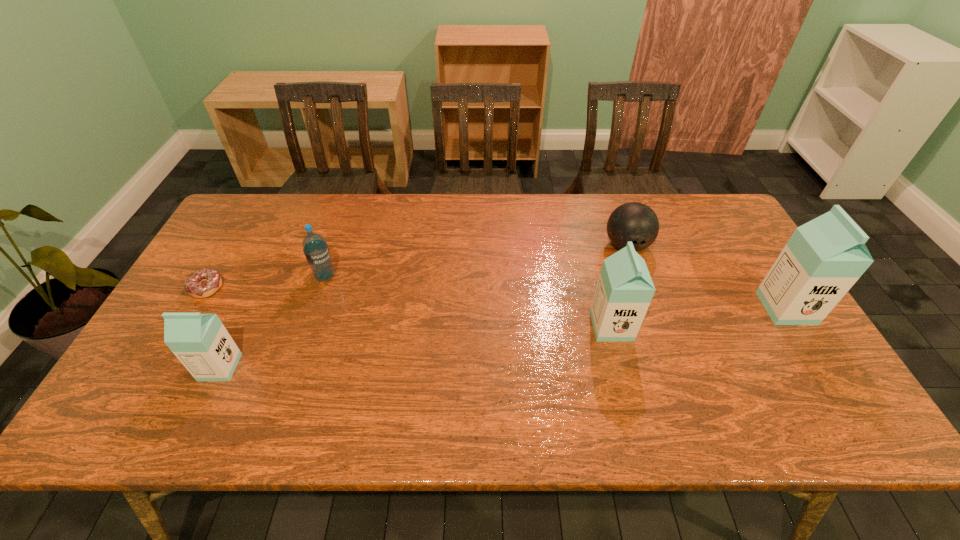
Locate an element on the screen. doughnut that is at the left edge is located at coordinates (203, 283).

I want to click on object positioned at the right edge, so click(x=823, y=259).

The height and width of the screenshot is (540, 960). What are the coordinates of `object that is at the near left corner` in the screenshot? It's located at (200, 341).

The image size is (960, 540). What are the coordinates of `vacant space at the far edge of the desktop` in the screenshot? It's located at (663, 197).

Locate an element on the screen. This screenshot has height=540, width=960. vacant region at the near edge of the desktop is located at coordinates click(x=307, y=374).

At what (x,y) coordinates should I click in order to perform the action: click on vacant space at the left edge. Please return your answer as a coordinate pair (x, y). Looking at the image, I should click on (220, 309).

At what (x,y) coordinates should I click in order to perform the action: click on vacant region at the right edge of the desktop. Please return your answer as a coordinate pair (x, y). Looking at the image, I should click on (703, 255).

In the image, there is a desktop. In order to click on vacant space at the far left corner in this screenshot , I will do `click(250, 208)`.

Identify the location of vacant area at the far right corner. Image resolution: width=960 pixels, height=540 pixels. tap(687, 197).

This screenshot has height=540, width=960. Identify the location of empty space between the second object from left to right and the farthest object. (423, 307).